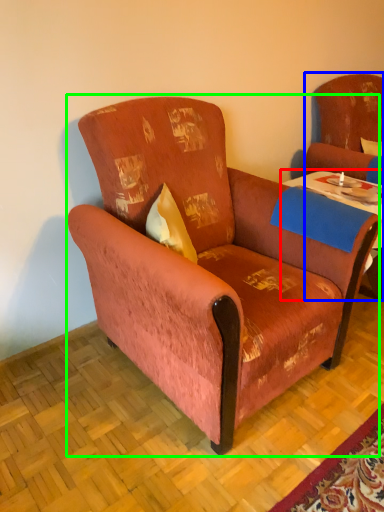
Question: Which object is the closest to the table (highlighted by a red box)? Choose among these: swivel chair (highlighted by a blue box) or chair (highlighted by a green box).

Choices:
 (A) swivel chair
 (B) chair

Answer: (A)